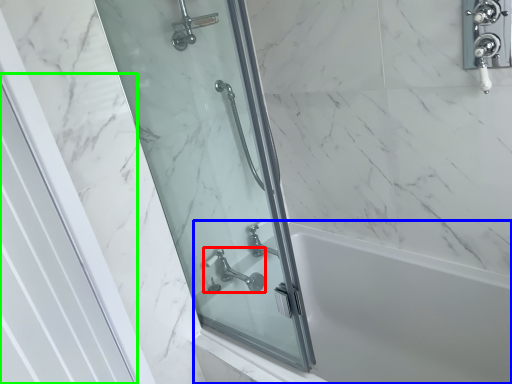
Question: Which object is the closest to the tap (highlighted by a red box)? Choose among these: bath (highlighted by a blue box) or screen door (highlighted by a green box).

Choices:
 (A) bath
 (B) screen door

Answer: (A)